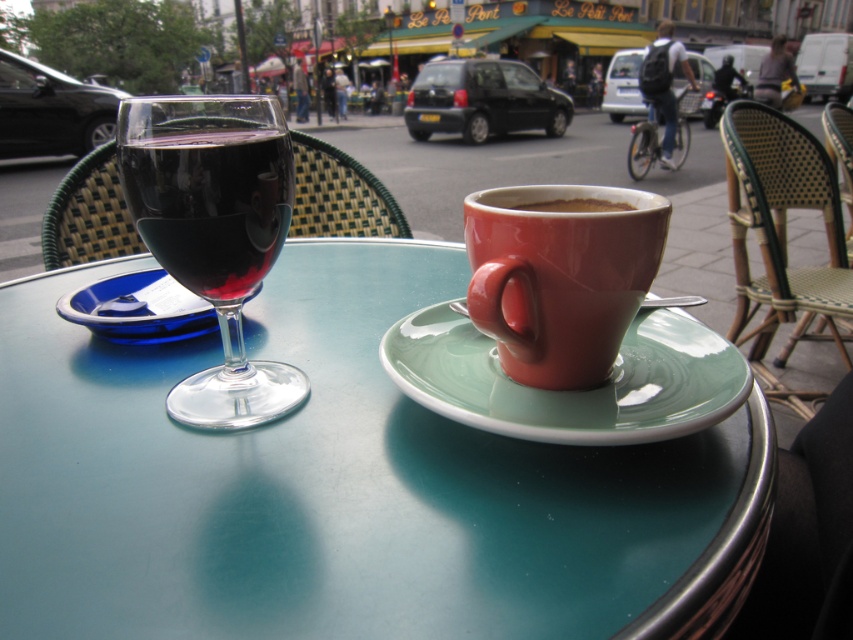
Is the position of blue glass saucer at left less distant than that of matte ceramic cup at center?

That is False.

Is point (155, 337) farther from camera compared to point (576, 209)?

Yes, point (155, 337) is behind point (576, 209).

Identify the location of blue glass saucer at left. The height and width of the screenshot is (640, 853). (138, 308).

You are a GUI agent. You are given a task and a screenshot of the screen. Output one action in this format:
    pyautogui.click(x=<x>, y=<y>)
    Task: Click on the matte ceramic mug at center
    The image size is (853, 640).
    Given the screenshot: What is the action you would take?
    pyautogui.click(x=560, y=275)

Who is more distant from viewer, (521, 188) or (556, 204)?

The point (521, 188) is more distant.

Measure the distance between point (502, 205) and camera.

Point (502, 205) and camera are 39.41 centimeters apart from each other.

Where is `matte ceramic mug at center`? This screenshot has width=853, height=640. matte ceramic mug at center is located at coordinates (560, 275).

Is matte ceramic mug at center taller than blue glass saucer at left?

Correct, matte ceramic mug at center is much taller as blue glass saucer at left.

Can you confirm if matte ceramic mug at center is thinner than blue glass saucer at left?

Correct, matte ceramic mug at center's width is less than blue glass saucer at left's.

Where is `matte ceramic mug at center`? The image size is (853, 640). matte ceramic mug at center is located at coordinates (560, 275).

This screenshot has height=640, width=853. Identify the location of matte ceramic mug at center. (560, 275).